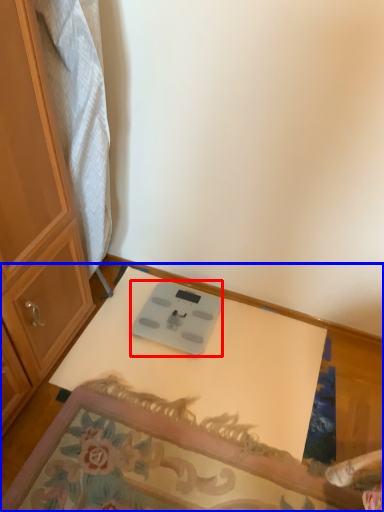
Question: Which of the following is the closest to the observer, weight scale (highlighted by a red box) or table (highlighted by a blue box)?

Choices:
 (A) weight scale
 (B) table

Answer: (B)